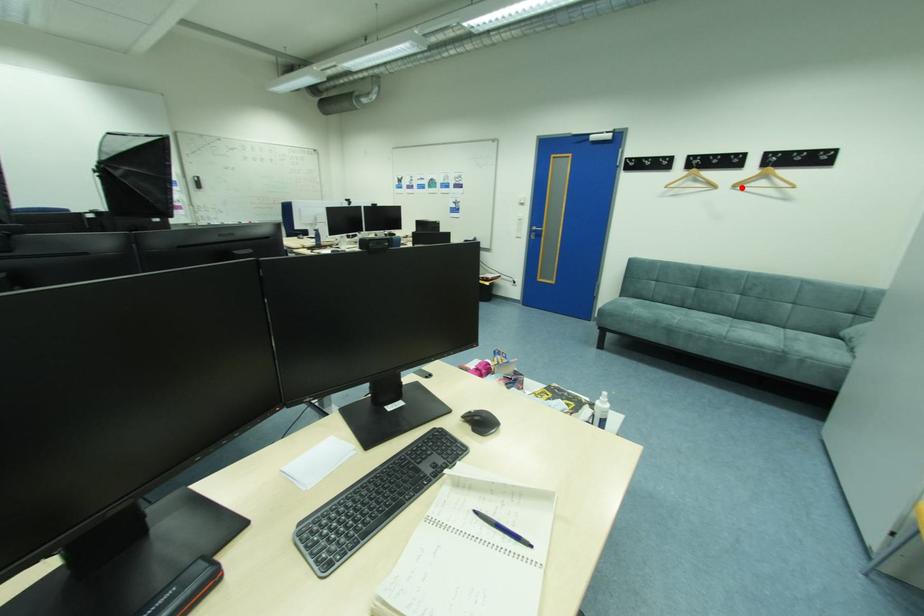
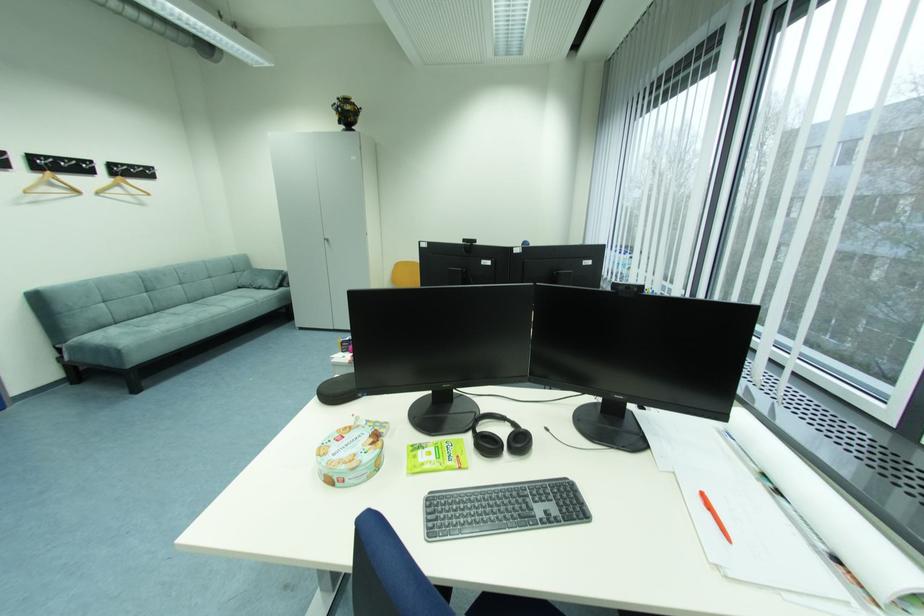
Question: I am providing you with two images of the same scene from different viewpoints. A red point is marked on the first image. At the location where the point appears in image 1, is it still visible in image 2?

Choices:
 (A) Yes
 (B) No

Answer: (A)